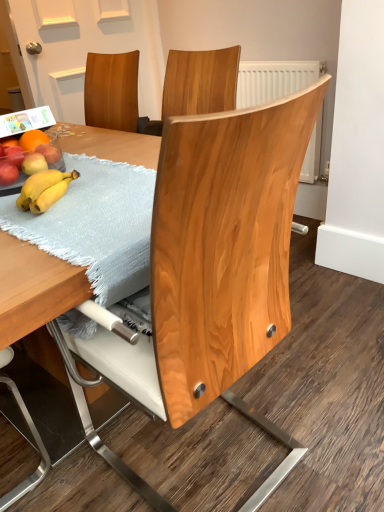
Question: Choose the correct answer: Is matte red apple at left, arranged as the fourth apple when viewed from the back, inside natural wood chair at center or outside it?

Choices:
 (A) inside
 (B) outside

Answer: (B)

Question: In terms of size, does matte red apple at left, arranged as the fourth apple when viewed from the back, appear bigger or smaller than natural wood chair at center?

Choices:
 (A) big
 (B) small

Answer: (B)

Question: Which is farther from the natural wood chair at center?

Choices:
 (A) light blue textured placemat at table
 (B) matte red apple at left, arranged as the 3th apple when viewed from the front
 (C) matte red apple at left, acting as the 1th apple starting from the front
 (D) matte red apple at left, marked as the first apple in a back-to-front arrangement
 (E) yellow matte apple at left, arranged as the 3th apple when viewed from the back

Answer: (D)

Question: Considering the real-world distances, which object is closest to the light blue textured placemat at table?

Choices:
 (A) natural wood chair at center
 (B) yellow matte apple at left, arranged as the second apple when viewed from the front
 (C) matte red apple at left, arranged as the 3th apple when viewed from the front
 (D) matte red apple at left, marked as the first apple in a back-to-front arrangement
 (E) matte red apple at left, arranged as the fourth apple when viewed from the back

Answer: (A)